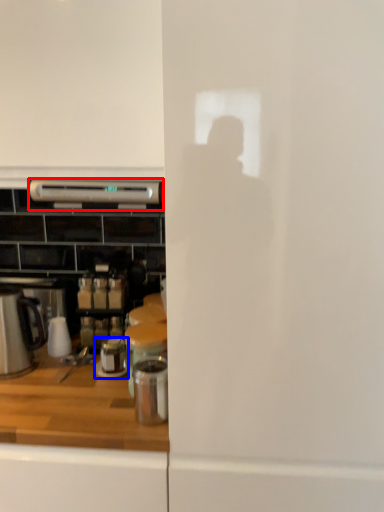
Question: Which object is closer to the camera taking this photo, kitchen appliance (highlighted by a red box) or appliance (highlighted by a blue box)?

Choices:
 (A) kitchen appliance
 (B) appliance

Answer: (A)